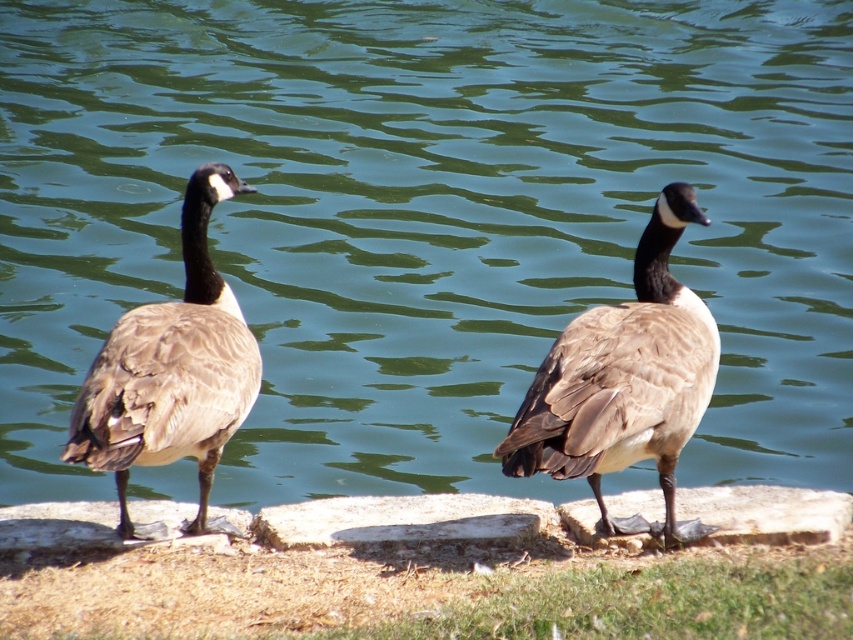
You are a birdwatcher observing two brown feathered ducks on a stone ledge. You see the brown feathered duck at center and the brown feathered duck at left. Which duck is closer to you?

The brown feathered duck at center is closer to you because it is further to the viewer than the brown feathered duck at left.

You are a wildlife photographer trying to capture a closeup of both the brown feathered duck at center and the brown feathered duck at left. Your camera has a maximum focus range of 1.5 meters. Can you photograph both ducks without moving your position?

The brown feathered duck at center is 1.32 meters away from the brown feathered duck at left. Since the distance between them is within your camera maximum focus range of 1.5 meters, you can photograph both ducks without moving your position.